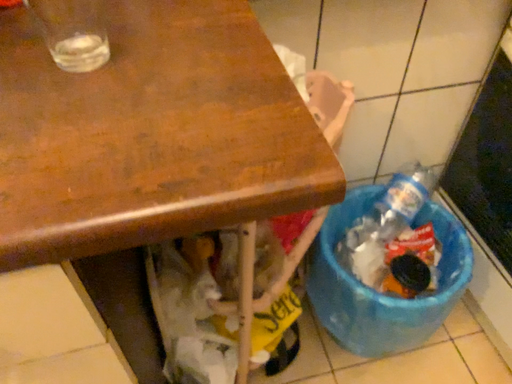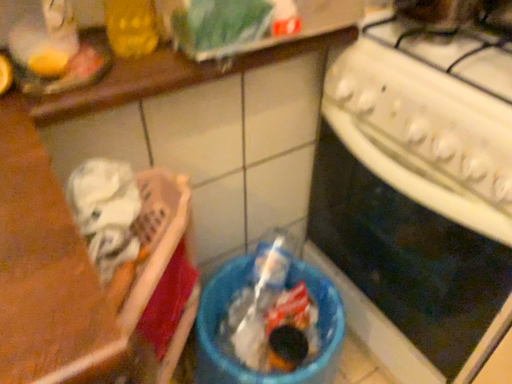
Question: Which way did the camera rotate in the video?

Choices:
 (A) rotated right
 (B) rotated left

Answer: (A)